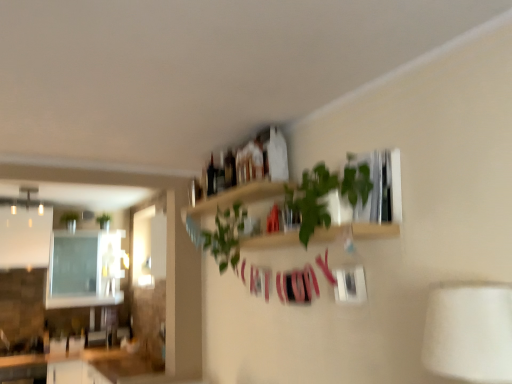
What do you see at coordinates (78, 366) in the screenshot? Image resolution: width=512 pixels, height=384 pixels. I see `white glossy countertop at lower left` at bounding box center [78, 366].

At what (x,y) coordinates should I click in order to perform the action: click on green leafy plant at upper center. Please return your answer as a coordinate pair (x, y). Looking at the image, I should click on (327, 193).

What do you see at coordinates (356, 231) in the screenshot?
I see `green leafy plant at upper center, the 2th shelf in the top-to-bottom sequence` at bounding box center [356, 231].

I want to click on green leafy plant at upper center, the 2th shelf in the top-to-bottom sequence, so click(356, 231).

The image size is (512, 384). What do you see at coordinates (226, 236) in the screenshot?
I see `green leafy plant at upper center, the second plant from the left` at bounding box center [226, 236].

The height and width of the screenshot is (384, 512). What are the coordinates of `green leafy plant at upper center, the 2th plant from the back` in the screenshot? It's located at (226, 236).

You are a GUI agent. You are given a task and a screenshot of the screen. Output one action in this format:
    pyautogui.click(x=<x>, y=<y>)
    Task: Click on the white fabric lampshade at lower right
    
    Given the screenshot: What is the action you would take?
    pyautogui.click(x=469, y=332)

This screenshot has width=512, height=384. Describe the element at coordinates (237, 197) in the screenshot. I see `wooden shelf at upper center, the 2th shelf ordered from the bottom` at that location.

What are the coordinates of `white glossy countertop at lower left` in the screenshot? It's located at coord(78,366).

Is green matte plant at upper left, placed as the second plant when sorted from front to back, closer to camera compared to green leafy plant at upper center, the 2th plant from the back?

No, green matte plant at upper left, placed as the second plant when sorted from front to back, is further to the viewer.

Between point (65, 213) and point (231, 260), which one is positioned behind?

Positioned behind is point (65, 213).

From a real-world perspective, is green matte plant at upper left, the second plant in the right-to-left sequence, physically below green leafy plant at upper center, the 2th plant from the back?

No, from a real-world perspective, green matte plant at upper left, the second plant in the right-to-left sequence, is not beneath green leafy plant at upper center, the 2th plant from the back.

Considering the positions of objects green leafy plant at upper center, the 2th shelf in the top-to-bottom sequence, and white fabric lampshade at lower right in the image provided, who is more to the right, green leafy plant at upper center, the 2th shelf in the top-to-bottom sequence, or white fabric lampshade at lower right?

From the viewer's perspective, white fabric lampshade at lower right appears more on the right side.

Which is in front, point (329, 238) or point (459, 301)?

The point (459, 301) is closer to the camera.

Is green leafy plant at upper center, the 2th shelf in the top-to-bottom sequence, directly adjacent to white fabric lampshade at lower right?

green leafy plant at upper center, the 2th shelf in the top-to-bottom sequence, and white fabric lampshade at lower right are not in contact.

Which object is further away from the camera, matte black bottle at upper center, the 2th bottle when ordered from back to front, or green leafy plant at upper center, the 2th shelf in the top-to-bottom sequence?

matte black bottle at upper center, the 2th bottle when ordered from back to front.

In the image, is matte black bottle at upper center, which appears as the 2th bottle when viewed from the left, on the left side or the right side of green leafy plant at upper center, marked as the first shelf in a bottom-to-top arrangement?

In the image, matte black bottle at upper center, which appears as the 2th bottle when viewed from the left, appears on the left side of green leafy plant at upper center, marked as the first shelf in a bottom-to-top arrangement.

From their relative heights in the image, would you say matte black bottle at upper center, the 2th bottle when ordered from back to front, is taller or shorter than green leafy plant at upper center, the 2th shelf in the top-to-bottom sequence?

matte black bottle at upper center, the 2th bottle when ordered from back to front, is taller than green leafy plant at upper center, the 2th shelf in the top-to-bottom sequence.

The width and height of the screenshot is (512, 384). I want to click on the 2nd shelf positioned below the matte black bottle at upper center, which appears as the 2th bottle when viewed from the left (from a real-world perspective), so click(x=356, y=231).

Is white glossy countertop at lower left in contact with green matte plant at upper left, placed as the second plant when sorted from front to back?

They are not placed beside each other.

Is white glossy countertop at lower left completely or partially outside of green matte plant at upper left, which appears as the 1th plant when viewed from the left?

Yes, white glossy countertop at lower left is not within green matte plant at upper left, which appears as the 1th plant when viewed from the left.

What's the angular difference between white glossy countertop at lower left and green matte plant at upper left, placed as the second plant when sorted from front to back,'s facing directions?

0.306 degrees separate the facing orientations of white glossy countertop at lower left and green matte plant at upper left, placed as the second plant when sorted from front to back.

Which of these two, white glossy countertop at lower left or green matte plant at upper left, the second plant in the right-to-left sequence, stands shorter?

Standing shorter between the two is green matte plant at upper left, the second plant in the right-to-left sequence.

This screenshot has height=384, width=512. I want to click on counter top behind the black glass bottle at upper center, the 1th bottle from the left, so click(x=78, y=366).

Considering the positions of objects black glass bottle at upper center, the 2th bottle in the front-to-back sequence, and white glossy countertop at lower left in the image provided, who is more to the right, black glass bottle at upper center, the 2th bottle in the front-to-back sequence, or white glossy countertop at lower left?

Positioned to the right is black glass bottle at upper center, the 2th bottle in the front-to-back sequence.

From the image's perspective, is black glass bottle at upper center, which ranks as the 1th bottle in back-to-front order, above or below white glossy countertop at lower left?

From the image's perspective, black glass bottle at upper center, which ranks as the 1th bottle in back-to-front order, appears above white glossy countertop at lower left.

Can you tell me how much black glass bottle at upper center, the 2th bottle in the front-to-back sequence, and white glossy countertop at lower left differ in facing direction?

The angular difference between black glass bottle at upper center, the 2th bottle in the front-to-back sequence, and white glossy countertop at lower left is 90.5 degrees.

Can you confirm if white fabric lampshade at lower right is positioned to the left of green leafy plant at upper center, the 2th shelf in the top-to-bottom sequence?

Incorrect, white fabric lampshade at lower right is not on the left side of green leafy plant at upper center, the 2th shelf in the top-to-bottom sequence.

Is white fabric lampshade at lower right looking in the opposite direction of green leafy plant at upper center, marked as the first shelf in a bottom-to-top arrangement?

No, white fabric lampshade at lower right is not facing the opposite direction of green leafy plant at upper center, marked as the first shelf in a bottom-to-top arrangement.

Can you confirm if white fabric lampshade at lower right is wider than green leafy plant at upper center, marked as the first shelf in a bottom-to-top arrangement?

Yes.

Which is in front, point (510, 288) or point (391, 226)?

Positioned in front is point (510, 288).

Identify the location of the 1st bottle positioned above the white fabric lampshade at lower right (from a real-world perspective). Image resolution: width=512 pixels, height=384 pixels. (x=230, y=169).

Does white fabric lampshade at lower right have a lesser width compared to matte black bottle at upper center, placed as the first bottle when sorted from right to left?

No, white fabric lampshade at lower right is not thinner than matte black bottle at upper center, placed as the first bottle when sorted from right to left.

From the image's perspective, which one is positioned lower, white fabric lampshade at lower right or matte black bottle at upper center, the 2th bottle when ordered from back to front?

white fabric lampshade at lower right appears lower in the image.

Can you tell me how much white fabric lampshade at lower right and matte black bottle at upper center, placed as the first bottle when sorted from front to back, differ in facing direction?

0.831 degrees.

Where is `plant behind the green leafy plant at upper center, which ranks as the 1th plant in front-to-back order`? This screenshot has width=512, height=384. plant behind the green leafy plant at upper center, which ranks as the 1th plant in front-to-back order is located at coordinates (70, 220).

Image resolution: width=512 pixels, height=384 pixels. Identify the location of table lamp below the green leafy plant at upper center, marked as the first shelf in a bottom-to-top arrangement (from the image's perspective). (469, 332).

Which object lies further to the anchor point green leafy plant at upper center, the second plant from the left, white glossy countertop at lower left or green matte plant at upper left, the second plant in the right-to-left sequence?

Among the two, green matte plant at upper left, the second plant in the right-to-left sequence, is located further to green leafy plant at upper center, the second plant from the left.

Estimate the real-world distances between objects in this image. Which object is further from white fabric lampshade at lower right, green leafy plant at upper center or matte black bottle at upper center, placed as the first bottle when sorted from front to back?

Based on the image, matte black bottle at upper center, placed as the first bottle when sorted from front to back, appears to be further to white fabric lampshade at lower right.

Looking at this image, when comparing their distances from matte black bottle at upper center, the 2th bottle when ordered from back to front, does green leafy plant at upper center, the 2th shelf in the top-to-bottom sequence, or white fabric lampshade at lower right seem closer?

The object closer to matte black bottle at upper center, the 2th bottle when ordered from back to front, is green leafy plant at upper center, the 2th shelf in the top-to-bottom sequence.

Estimate the real-world distances between objects in this image. Which object is further from black glass bottle at upper center, which is counted as the 2th bottle, starting from the right, white glossy countertop at lower left or white fabric lampshade at lower right?

Based on the image, white glossy countertop at lower left appears to be further to black glass bottle at upper center, which is counted as the 2th bottle, starting from the right.

When comparing their distances from matte black bottle at upper center, placed as the first bottle when sorted from right to left, does white fabric lampshade at lower right or wooden shelf at upper center, the 2th shelf ordered from the bottom, seem further?

white fabric lampshade at lower right lies further to matte black bottle at upper center, placed as the first bottle when sorted from right to left, than the other object.

Looking at this image, from the image, which object appears to be farther from black glass bottle at upper center, which is counted as the 2th bottle, starting from the right, green matte plant at upper left, placed as the second plant when sorted from front to back, or white glossy countertop at lower left?

green matte plant at upper left, placed as the second plant when sorted from front to back, is positioned further to the anchor black glass bottle at upper center, which is counted as the 2th bottle, starting from the right.

Considering their positions, is white glossy countertop at lower left positioned further to green matte plant at upper left, the second plant in the right-to-left sequence, than green leafy plant at upper center, the 1th plant when ordered from right to left?

green leafy plant at upper center, the 1th plant when ordered from right to left, lies further to green matte plant at upper left, the second plant in the right-to-left sequence, than the other object.

Consider the image. Considering their positions, is black glass bottle at upper center, which ranks as the 1th bottle in back-to-front order, positioned closer to wooden shelf at upper center, the 2th shelf ordered from the bottom, than green leafy plant at upper center, the 2th plant from the back?

Among the two, green leafy plant at upper center, the 2th plant from the back, is located nearer to wooden shelf at upper center, the 2th shelf ordered from the bottom.

Where is `bottle between white fabric lampshade at lower right and black glass bottle at upper center, which ranks as the 1th bottle in back-to-front order, in the front-back direction`? This screenshot has width=512, height=384. bottle between white fabric lampshade at lower right and black glass bottle at upper center, which ranks as the 1th bottle in back-to-front order, in the front-back direction is located at coordinates (230, 169).

The width and height of the screenshot is (512, 384). I want to click on bottle between matte black bottle at upper center, which appears as the 2th bottle when viewed from the left, and white glossy countertop at lower left vertically, so click(x=211, y=178).

You are a GUI agent. You are given a task and a screenshot of the screen. Output one action in this format:
    pyautogui.click(x=<x>, y=<y>)
    Task: Click on the shelf situated between white glossy countertop at lower left and green leafy plant at upper center, the second plant from the left, from left to right
    This screenshot has height=384, width=512.
    Given the screenshot: What is the action you would take?
    pyautogui.click(x=237, y=197)

Find the location of a particular element. bottle between green leafy plant at upper center, which ranks as the 1th plant in front-to-back order, and black glass bottle at upper center, the 1th bottle from the left, along the z-axis is located at coordinates (230, 169).